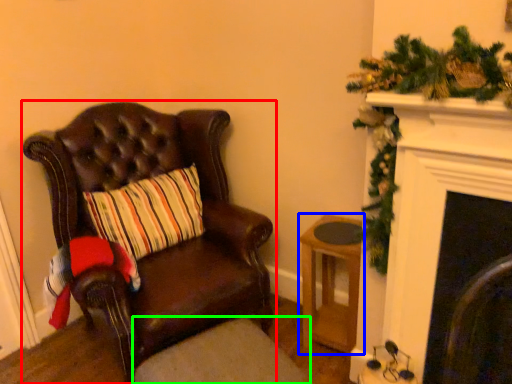
Question: Considering the real-world distances, which object is closest to chair (highlighted by a red box)? stool (highlighted by a blue box) or footrest (highlighted by a green box).

Choices:
 (A) stool
 (B) footrest

Answer: (B)